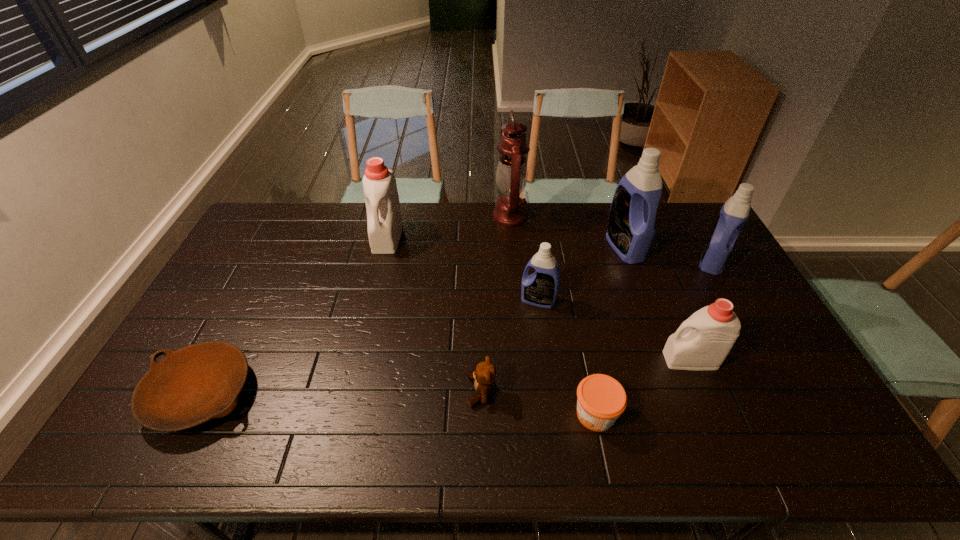
In the image, there is a desktop. Where is `vacant space at the far left corner`? This screenshot has height=540, width=960. vacant space at the far left corner is located at coordinates (261, 212).

Locate an element on the screen. The width and height of the screenshot is (960, 540). vacant space at the far right corner of the desktop is located at coordinates (685, 237).

You are a GUI agent. You are given a task and a screenshot of the screen. Output one action in this format:
    pyautogui.click(x=<x>, y=<y>)
    Task: Click on the unoccupied area between the plate and the leftmost detergent
    
    Given the screenshot: What is the action you would take?
    pyautogui.click(x=294, y=315)

Find the location of `vacant area that lies between the bigger white detergent and the jam`. vacant area that lies between the bigger white detergent and the jam is located at coordinates (492, 326).

The height and width of the screenshot is (540, 960). Identify the location of vacant point located between the nearer white detergent and the second shortest object. (643, 387).

Locate an element on the screen. free spot between the shortest object and the bigger white detergent is located at coordinates (294, 315).

The width and height of the screenshot is (960, 540). What are the coordinates of `free space between the second shortest object and the leftmost object` in the screenshot? It's located at (398, 404).

Locate an element on the screen. Image resolution: width=960 pixels, height=540 pixels. free spot between the second biggest blue detergent and the brown teddy bear is located at coordinates (597, 326).

At what (x,y) coordinates should I click in order to perform the action: click on empty space that is in between the oil lamp and the seventh tallest object. Please return your answer as a coordinate pair (x, y). The height and width of the screenshot is (540, 960). Looking at the image, I should click on (495, 304).

Image resolution: width=960 pixels, height=540 pixels. I want to click on the eighth closest object to the red oil lamp, so click(x=200, y=382).